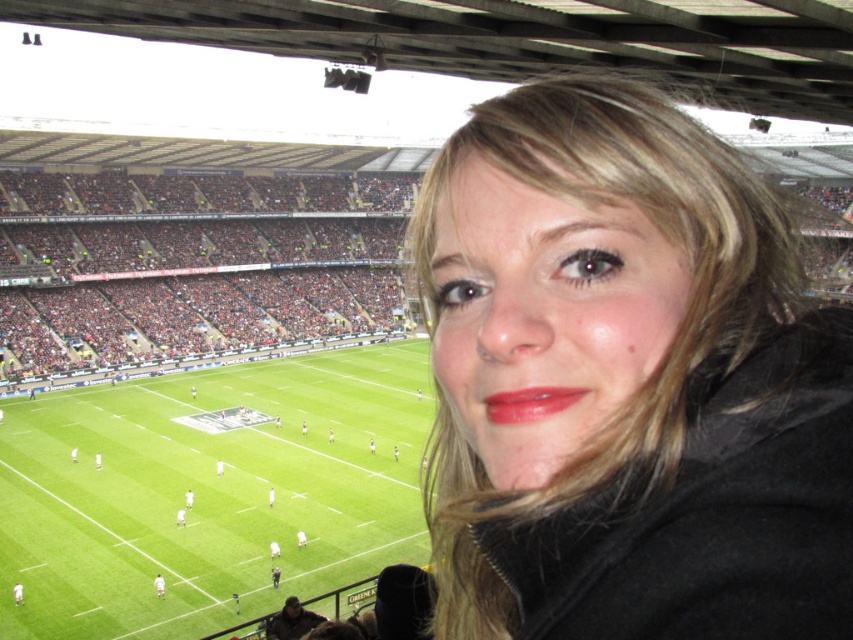
In the scene shown: You are a photographer standing in the center of the stadium. You notice the black matte jacket at right in your camera viewfinder. Based on its position, can you estimate whether it is closer to the front or the back of the stadium?

The black matte jacket at right is located at point coordinates that place it closer to the front of the stadium since it is positioned at the lower part of the frame, which typically corresponds to the foreground in such images.

You are a photographer trying to capture a clear shot of the shiny red lipstick at center without the black matte jacket at right blocking it. What should you do?

The black matte jacket at right is in front of the shiny red lipstick at center, so to avoid the jacket blocking the view, you should move your position to the left side of the frame.

You are a photographer trying to capture the entire football field in your shot. You notice the black matte jacket at right and the green grass football field at center. Which object should you focus on to ensure the football field is fully visible?

The black matte jacket at right has a smaller size compared to green grass football field at center, so focusing on the green grass football field at center will ensure the entire football field is visible in the shot.